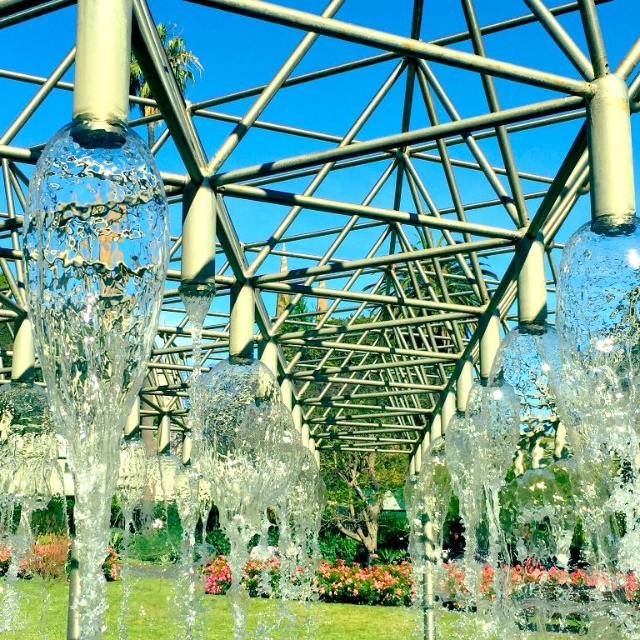
Question: Which of the following is the farthest from the observer?

Choices:
 (A) floral vibrant petals at center
 (B) transparent glass water at center left

Answer: (A)

Question: Does transparent glass water at center left appear over floral vibrant petals at center?

Choices:
 (A) yes
 (B) no

Answer: (A)

Question: In this image, where is transparent glass water at center left located relative to floral vibrant petals at center?

Choices:
 (A) left
 (B) right

Answer: (A)

Question: Which object is closer to the camera taking this photo?

Choices:
 (A) transparent glass water at center left
 (B) floral vibrant petals at center

Answer: (A)

Question: Can you confirm if transparent glass water at center left is positioned to the right of floral vibrant petals at center?

Choices:
 (A) yes
 (B) no

Answer: (B)